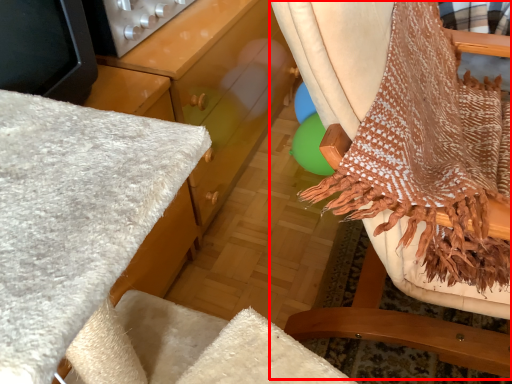
Question: From the image's perspective, what is the correct spatial relationship of chair (annotated by the red box) in relation to appliance?

Choices:
 (A) above
 (B) below

Answer: (B)